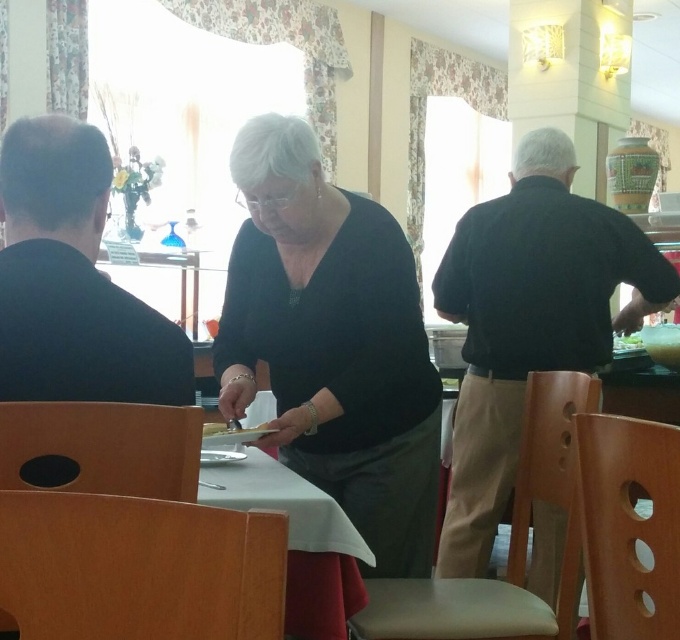
You are standing in the dining area and want to take a photo of the plate with food on the table. You notice two points marked on the tablecloth. The first point is at coordinates point (390, 637) and the second point is at point (226, 424). Which point should you focus on to ensure the plate is in sharp focus?

You should focus on point (390, 637) because it is closer to the camera than point (226, 424). This proximity ensures that the plate will be in sharper focus when taking the photo.

You are a guest at a community event and notice the black matte dress at center and the wooden chair at lower center. Which object is placed on top of the other?

The black matte dress at center is positioned over the wooden chair at lower center.

You are organizing a small event and need to place a 1.2 meter wide tablecloth on the table. The black matte dress at center is currently on the table. Can the wooden chair at lower center fit under the tablecloth without moving the dress?

The black matte dress at center might be wider than wooden chair at lower center, so it is uncertain if the chair will fit under the tablecloth without moving the dress. The dress could potentially block the space needed for the chair.